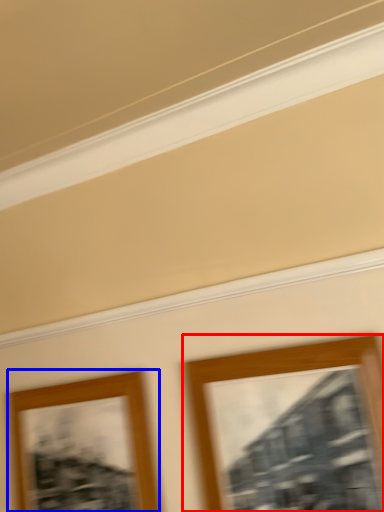
Question: Among these objects, which one is farthest to the camera, picture frame (highlighted by a red box) or picture frame (highlighted by a blue box)?

Choices:
 (A) picture frame
 (B) picture frame

Answer: (B)